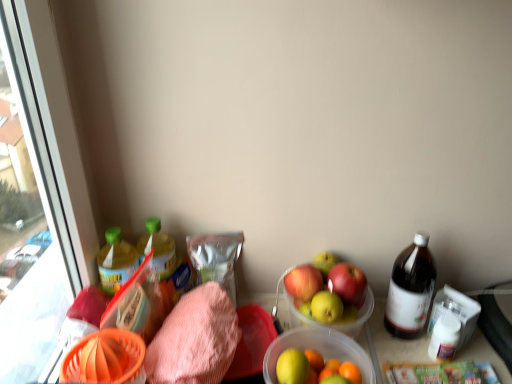
Question: Is brown glass bottle at right, the 1th bottle viewed from the right, outside of green plastic bottle at left, positioned as the first bottle in left-to-right order?

Choices:
 (A) no
 (B) yes

Answer: (B)

Question: Can you confirm if brown glass bottle at right, the 1th bottle viewed from the right, is smaller than green plastic bottle at left, positioned as the first bottle in left-to-right order?

Choices:
 (A) no
 (B) yes

Answer: (A)

Question: Is the depth of brown glass bottle at right, the 1th bottle viewed from the right, greater than that of green plastic bottle at left, positioned as the first bottle in left-to-right order?

Choices:
 (A) yes
 (B) no

Answer: (B)

Question: Can you confirm if brown glass bottle at right, arranged as the 3th bottle when viewed from the left, is bigger than green plastic bottle at left, the third bottle in the right-to-left sequence?

Choices:
 (A) no
 (B) yes

Answer: (B)

Question: Is green plastic bottle at left, positioned as the first bottle in left-to-right order, at the back of brown glass bottle at right, the 1th bottle viewed from the right?

Choices:
 (A) yes
 (B) no

Answer: (B)

Question: Does brown glass bottle at right, arranged as the 3th bottle when viewed from the left, have a lesser width compared to green plastic bottle at left, the third bottle in the right-to-left sequence?

Choices:
 (A) yes
 (B) no

Answer: (B)

Question: Is green plastic bottle at left, the third bottle in the right-to-left sequence, thinner than translucent plastic bowl at center?

Choices:
 (A) no
 (B) yes

Answer: (B)

Question: Is green plastic bottle at left, positioned as the first bottle in left-to-right order, to the right of translucent plastic bowl at center from the viewer's perspective?

Choices:
 (A) yes
 (B) no

Answer: (B)

Question: Is green plastic bottle at left, positioned as the first bottle in left-to-right order, shorter than translucent plastic bowl at center?

Choices:
 (A) yes
 (B) no

Answer: (A)

Question: From a real-world perspective, is green plastic bottle at left, the third bottle in the right-to-left sequence, under translucent plastic bowl at center?

Choices:
 (A) no
 (B) yes

Answer: (A)

Question: Is translucent plastic bowl at center a part of green plastic bottle at left, the third bottle in the right-to-left sequence?

Choices:
 (A) no
 (B) yes

Answer: (A)

Question: Can you confirm if green plastic bottle at left, positioned as the first bottle in left-to-right order, is bigger than translucent plastic bowl at center?

Choices:
 (A) no
 (B) yes

Answer: (A)

Question: From a real-world perspective, does pink terry cloth towel at lower left stand above translucent plastic bowl at center?

Choices:
 (A) yes
 (B) no

Answer: (B)